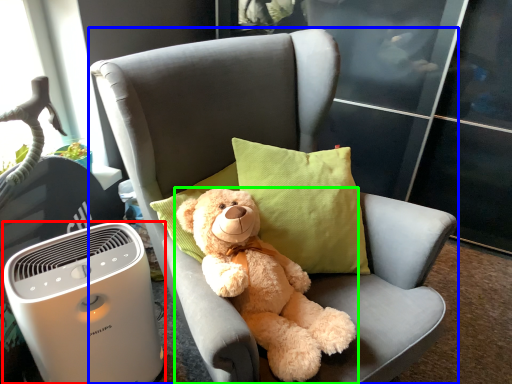
Question: Which object is positioned farthest from home appliance (highlighted by a red box)? Select from chair (highlighted by a blue box) and teddy bear (highlighted by a green box).

Choices:
 (A) chair
 (B) teddy bear

Answer: (B)